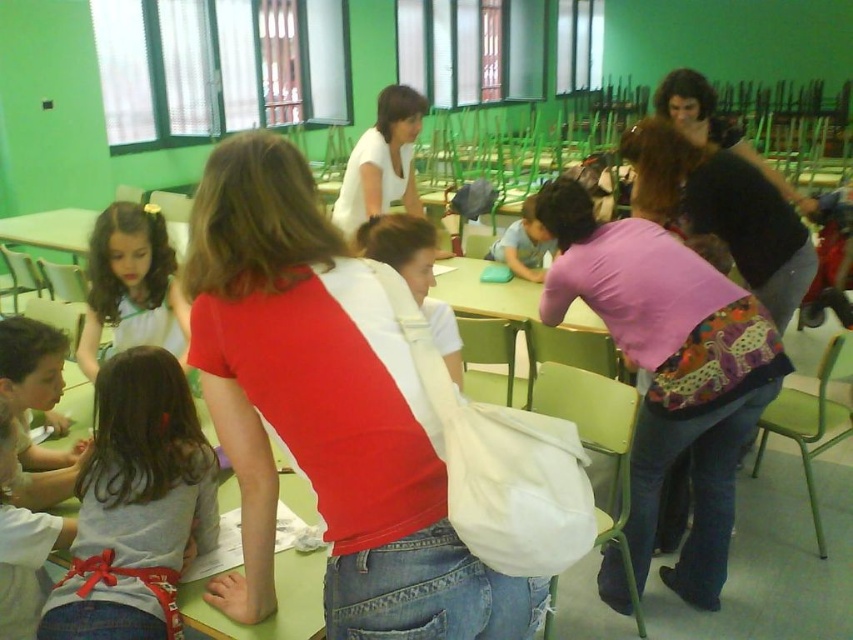
You are a teacher in the classroom and want to hand out a pencil case to a student. You see the white matte shirt at center and the matte blue pencil case at center. Which object is higher up in the image?

The white matte shirt at center is taller than the matte blue pencil case at center, so the white matte shirt at center is higher up in the image.

You are a teacher in the classroom and need to retrieve the matte blue pencil case at center. Is the matte white shirt at center blocking your direct path to it?

Yes, the matte white shirt at center is blocking the direct path to the matte blue pencil case at center because it is positioned in front of it.

You are a teacher in the classroom and need to locate the pink fabric shirt at center. According to the coordinates provided, where would you find it?

The pink fabric shirt at center is located at point 0.578 on the x axis and 0.785 on the y axis.